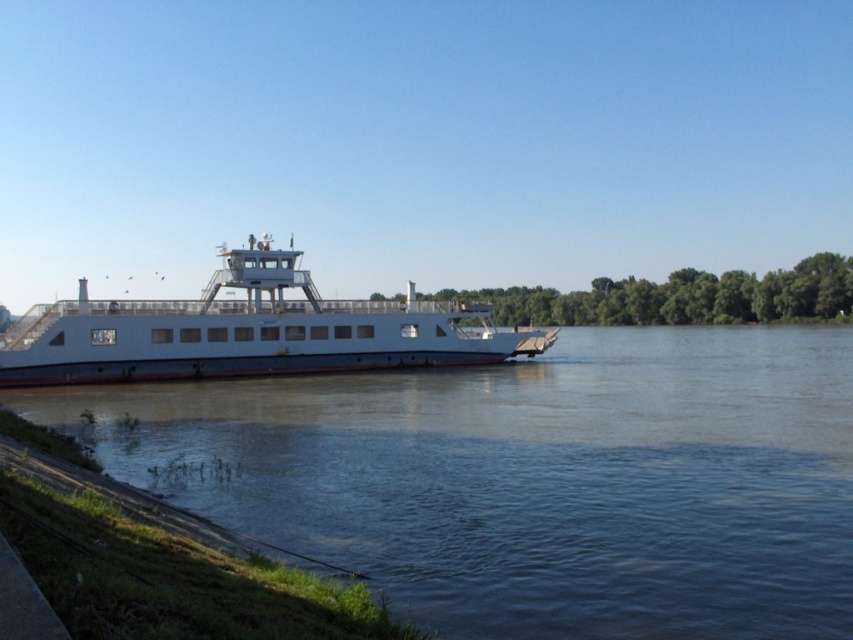
You are a passenger on the white matte ferry at center and want to disembark onto the riverbank. Which direction should you walk to get to the brown matte river at center?

The brown matte river at center is to the right of the white matte ferry at center, so you should walk to the right to reach the brown matte river at center.

You are a photographer planning to take a wide shot of the brown matte river at center and the white matte ferry at center. Based on the scene, which object should you focus on first if you want to capture both in the frame without moving the camera?

The white matte ferry at center occupies more space in the frame than the brown matte river at center, so focusing on the white matte ferry at center first would ensure it is centered and properly framed, allowing the smaller brown matte river at center to fit into the shot as well.